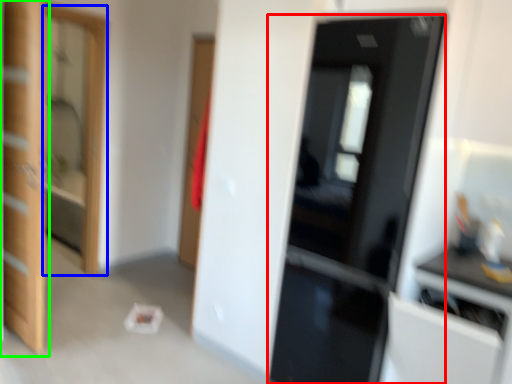
Question: Which object is positioned farthest from door (highlighted by a red box)? Select from screen door (highlighted by a blue box) and door (highlighted by a green box).

Choices:
 (A) screen door
 (B) door

Answer: (A)